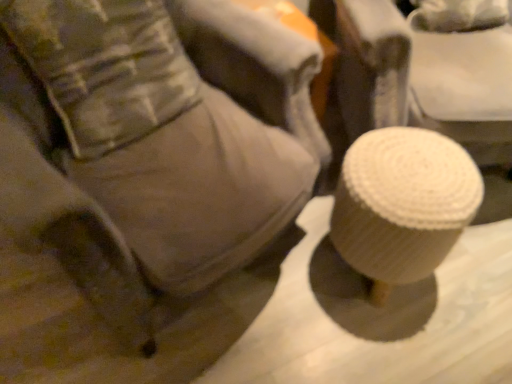
Question: Looking at the image, does white textured stool at lower right seem bigger or smaller compared to camouflage fabric pillow at upper left?

Choices:
 (A) small
 (B) big

Answer: (B)

Question: Is white textured stool at lower right to the left or to the right of camouflage fabric pillow at upper left in the image?

Choices:
 (A) right
 (B) left

Answer: (A)

Question: From a real-world perspective, is white textured stool at lower right above or below camouflage fabric pillow at upper left?

Choices:
 (A) below
 (B) above

Answer: (A)

Question: Considering the positions of camouflage fabric pillow at upper left and white textured stool at lower right in the image, is camouflage fabric pillow at upper left taller or shorter than white textured stool at lower right?

Choices:
 (A) short
 (B) tall

Answer: (A)

Question: From a real-world perspective, is camouflage fabric pillow at upper left positioned above or below white textured stool at lower right?

Choices:
 (A) above
 (B) below

Answer: (A)

Question: In the image, is camouflage fabric pillow at upper left positioned in front of or behind white textured stool at lower right?

Choices:
 (A) front
 (B) behind

Answer: (B)

Question: In terms of width, does camouflage fabric pillow at upper left look wider or thinner when compared to white textured stool at lower right?

Choices:
 (A) wide
 (B) thin

Answer: (B)